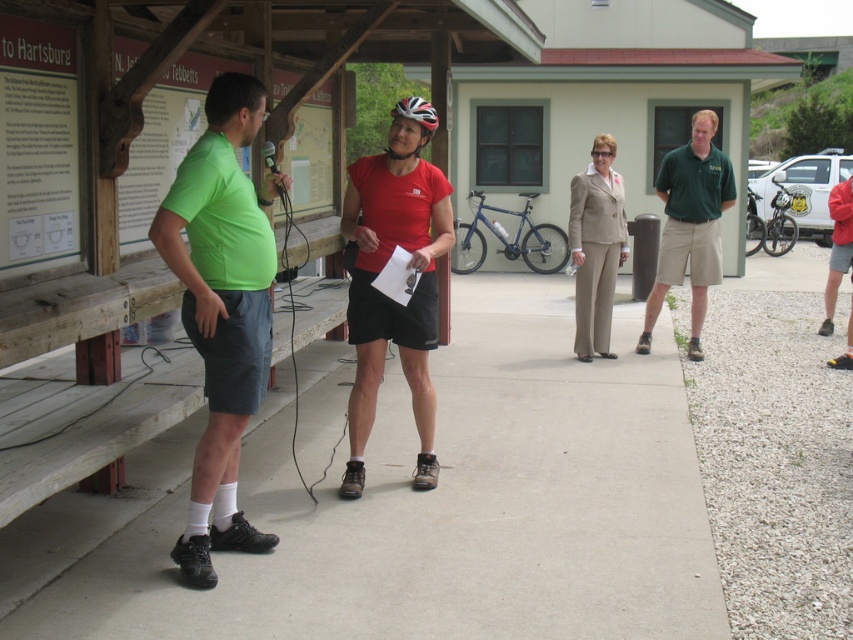
Question: Is gray concrete pavement at center above green cotton polo shirt at right?

Choices:
 (A) no
 (B) yes

Answer: (A)

Question: Which point is closer to the camera?

Choices:
 (A) beige fabric suit at center
 (B) green cotton polo shirt at right
 (C) wooden signboard at left
 (D) white glossy bicycle helmet at center

Answer: (C)

Question: Considering the real-world distances, which object is farthest from the beige fabric suit at center?

Choices:
 (A) green matte shorts at left
 (B) wooden signboard at left
 (C) white glossy bicycle helmet at center
 (D) green cotton polo shirt at right

Answer: (B)

Question: Does green matte shorts at left appear over wooden signboard at left?

Choices:
 (A) no
 (B) yes

Answer: (A)

Question: Which of the following is the farthest from the observer?

Choices:
 (A) 196,172
 (B) 450,577

Answer: (B)

Question: From the image, what is the correct spatial relationship of beige fabric suit at center in relation to white glossy bicycle helmet at center?

Choices:
 (A) below
 (B) above

Answer: (A)